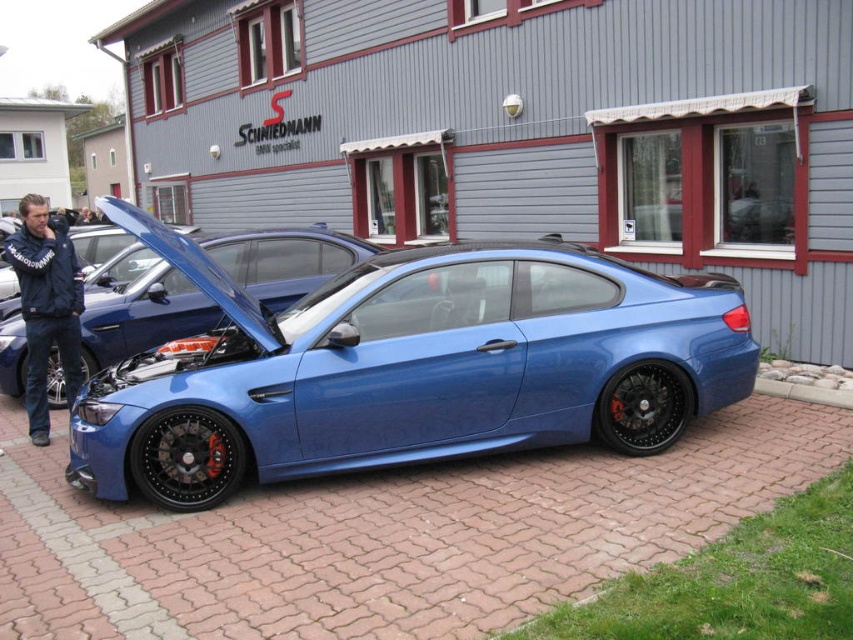
Question: Does metallic blue sports car at center have a smaller size compared to satin blue car at center?

Choices:
 (A) no
 (B) yes

Answer: (A)

Question: Which object is the closest to the satin blue car at center?

Choices:
 (A) blue fabric jacket at left
 (B) metallic blue sports car at center

Answer: (A)

Question: Can you confirm if metallic blue sports car at center is positioned below satin blue car at center?

Choices:
 (A) no
 (B) yes

Answer: (B)

Question: Estimate the real-world distances between objects in this image. Which object is closer to the metallic blue sports car at center?

Choices:
 (A) satin blue car at center
 (B) blue fabric jacket at left

Answer: (A)

Question: Does satin blue car at center appear on the right side of blue fabric jacket at left?

Choices:
 (A) no
 (B) yes

Answer: (B)

Question: Among these points, which one is nearest to the camera?

Choices:
 (A) (740, 369)
 (B) (115, 257)
 (C) (27, 230)

Answer: (A)